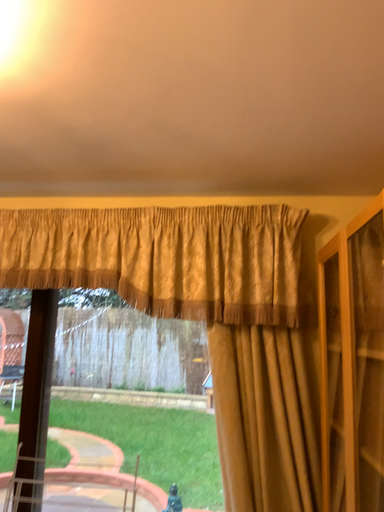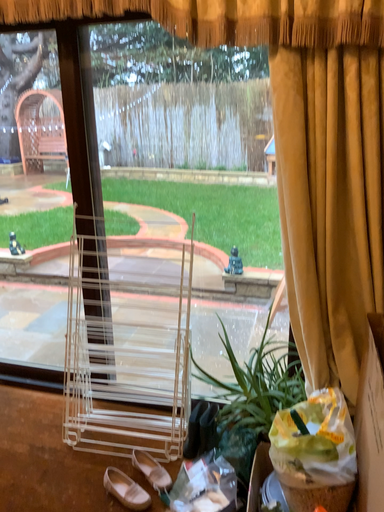
Question: Which way did the camera rotate in the video?

Choices:
 (A) rotated downward
 (B) rotated upward

Answer: (A)